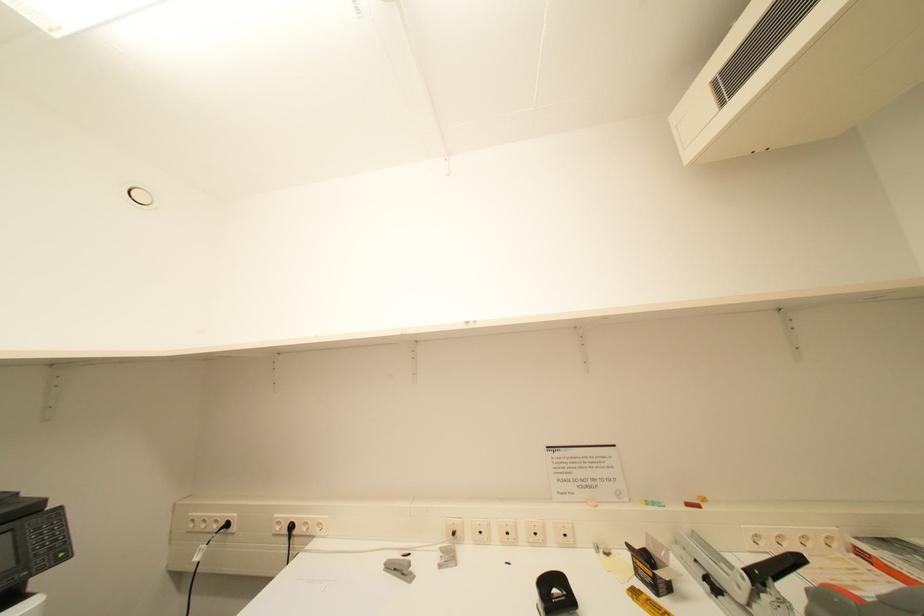
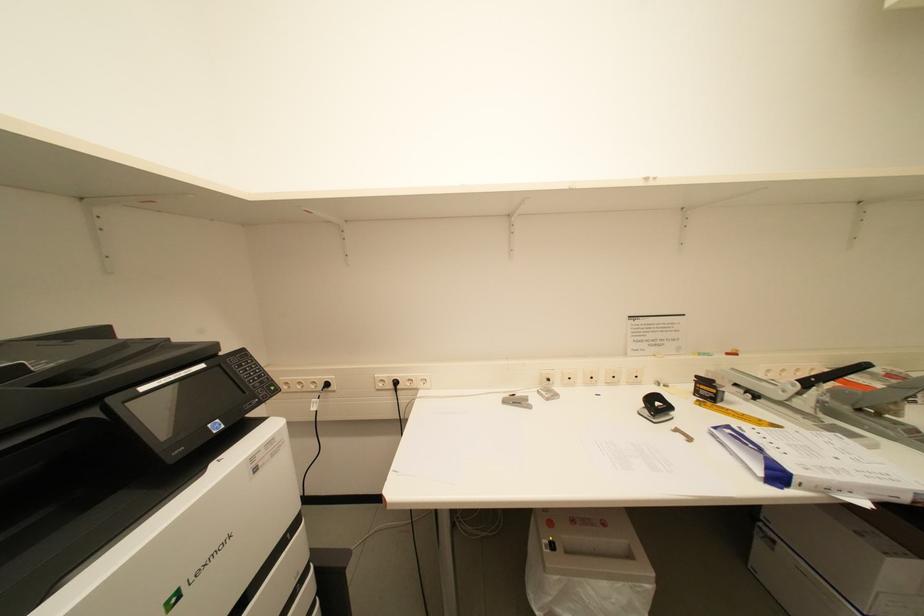
Question: What movement of the cameraman would produce the second image?

Choices:
 (A) Left
 (B) Right
 (C) Forward
 (D) Backward

Answer: (A)